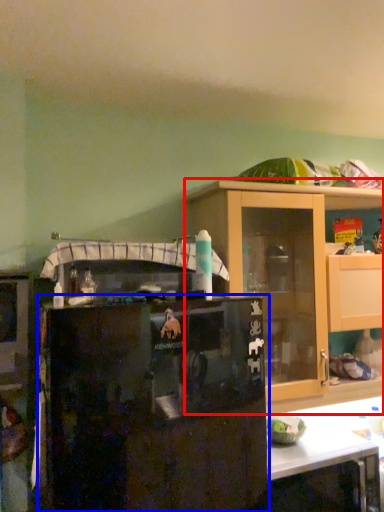
Question: Which of the following is the farthest to the observer, cabinetry (highlighted by a red box) or refrigerator (highlighted by a blue box)?

Choices:
 (A) cabinetry
 (B) refrigerator

Answer: (A)